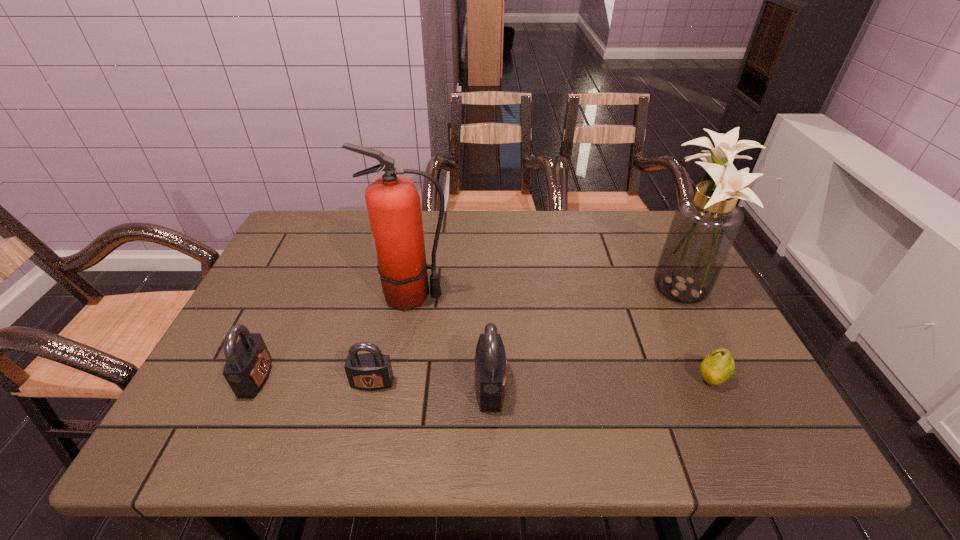
Locate an element on the screen. free space located on the left of the flower arrangement is located at coordinates (581, 286).

Image resolution: width=960 pixels, height=540 pixels. I want to click on vacant point located 0.380m on the nozzle of the fire extinguisher, so 596,296.

Find the location of `vacant region located 0.390m on the left of the shortest object`. vacant region located 0.390m on the left of the shortest object is located at coordinates pyautogui.click(x=513, y=379).

You are a GUI agent. You are given a task and a screenshot of the screen. Output one action in this format:
    pyautogui.click(x=<x>, y=<y>)
    Task: Click on the pear situated at the near edge
    
    Given the screenshot: What is the action you would take?
    pyautogui.click(x=718, y=366)

Identify the location of object present at the left edge. The image size is (960, 540). (248, 364).

This screenshot has height=540, width=960. I want to click on flower arrangement positioned at the right edge, so click(x=705, y=224).

I want to click on pear that is at the right edge, so click(718, 366).

I want to click on object present at the near left corner, so click(x=248, y=364).

Where is `object at the near right corner`? object at the near right corner is located at coordinates (718, 366).

You are a GUI agent. You are given a task and a screenshot of the screen. Output one action in this format:
    pyautogui.click(x=<x>, y=<y>)
    Task: Click on the free space at the far edge of the desktop
    The height and width of the screenshot is (540, 960).
    Given the screenshot: What is the action you would take?
    pyautogui.click(x=515, y=245)